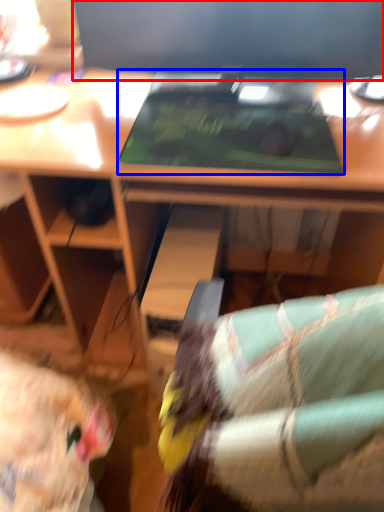
Question: Which point is further to the camera, computer monitor (highlighted by a red box) or laptop (highlighted by a blue box)?

Choices:
 (A) computer monitor
 (B) laptop

Answer: (A)